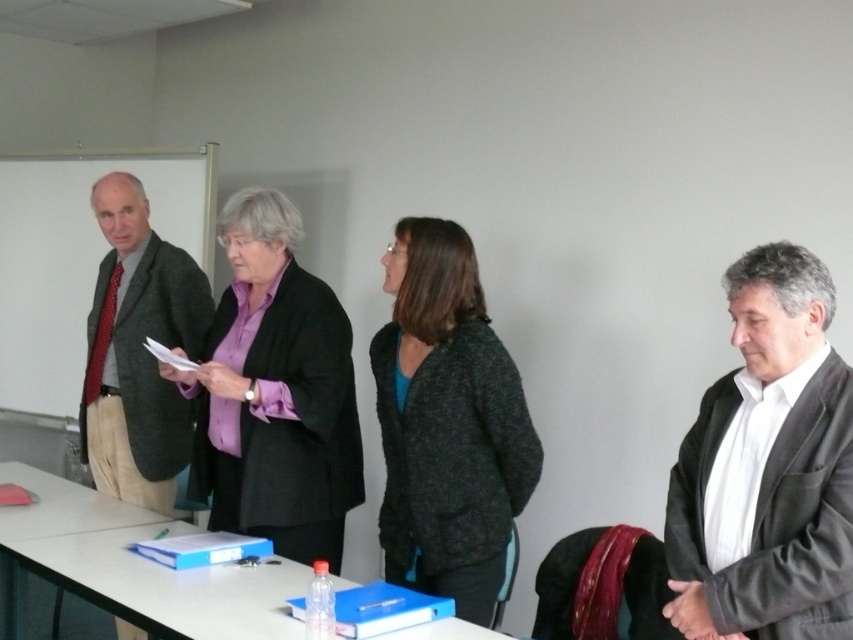
Question: Is matte gray blazer at left below white plastic table at lower left?

Choices:
 (A) yes
 (B) no

Answer: (B)

Question: Does matte gray blazer at left lie in front of white plastic table at lower left?

Choices:
 (A) yes
 (B) no

Answer: (B)

Question: Which point is closer to the camera?

Choices:
 (A) (756, 300)
 (B) (96, 348)
 (C) (109, 563)

Answer: (A)

Question: Which object appears closest to the camera in this image?

Choices:
 (A) white plastic table at lower left
 (B) purple matte shirt at center
 (C) dark gray woolen sweater at center
 (D) matte gray blazer at left

Answer: (A)

Question: In this image, where is purple matte shirt at center located relative to matte gray blazer at left?

Choices:
 (A) left
 (B) right

Answer: (B)

Question: Among these objects, which one is farthest from the camera?

Choices:
 (A) white plastic table at lower left
 (B) purple matte shirt at center

Answer: (B)